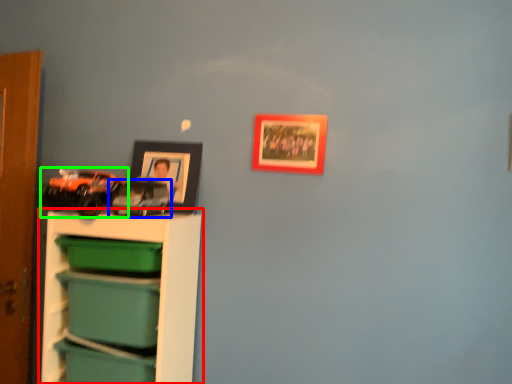
Question: Estimate the real-world distances between objects in this image. Which object is farther from shelf (highlighted by a red box), toy (highlighted by a blue box) or toy (highlighted by a green box)?

Choices:
 (A) toy
 (B) toy

Answer: (A)